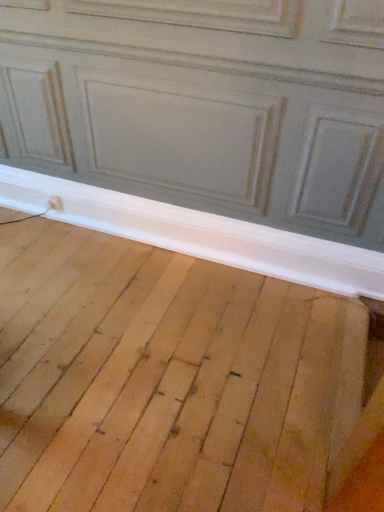
Question: Should I look upward or downward to see white wood baseboard at lower center?

Choices:
 (A) up
 (B) down

Answer: (A)

Question: Should I look upward or downward to see natural wood floor at lower center?

Choices:
 (A) down
 (B) up

Answer: (A)

Question: Is white wood baseboard at lower center to the right of natural wood floor at lower center from the viewer's perspective?

Choices:
 (A) no
 (B) yes

Answer: (B)

Question: From a real-world perspective, is white wood baseboard at lower center located higher than natural wood floor at lower center?

Choices:
 (A) no
 (B) yes

Answer: (B)

Question: Is white wood baseboard at lower center directly adjacent to natural wood floor at lower center?

Choices:
 (A) no
 (B) yes

Answer: (A)

Question: Are white wood baseboard at lower center and natural wood floor at lower center far apart?

Choices:
 (A) no
 (B) yes

Answer: (A)

Question: Considering the relative sizes of white wood baseboard at lower center and natural wood floor at lower center in the image provided, is white wood baseboard at lower center taller than natural wood floor at lower center?

Choices:
 (A) yes
 (B) no

Answer: (A)

Question: Is white wood baseboard at lower center aimed at natural wood floor at lower center?

Choices:
 (A) yes
 (B) no

Answer: (A)

Question: From the image's perspective, does natural wood floor at lower center appear lower than white wood baseboard at lower center?

Choices:
 (A) no
 (B) yes

Answer: (B)

Question: Does natural wood floor at lower center have a lesser width compared to white wood baseboard at lower center?

Choices:
 (A) yes
 (B) no

Answer: (B)

Question: Is the surface of natural wood floor at lower center in direct contact with white wood baseboard at lower center?

Choices:
 (A) no
 (B) yes

Answer: (A)

Question: From a real-world perspective, is natural wood floor at lower center positioned under white wood baseboard at lower center based on gravity?

Choices:
 (A) yes
 (B) no

Answer: (A)

Question: Considering the relative sizes of natural wood floor at lower center and white wood baseboard at lower center in the image provided, is natural wood floor at lower center wider than white wood baseboard at lower center?

Choices:
 (A) yes
 (B) no

Answer: (A)

Question: Is natural wood floor at lower center further to the viewer compared to white wood baseboard at lower center?

Choices:
 (A) no
 (B) yes

Answer: (A)

Question: In terms of height, does white wood baseboard at lower center look taller or shorter compared to natural wood floor at lower center?

Choices:
 (A) short
 (B) tall

Answer: (B)